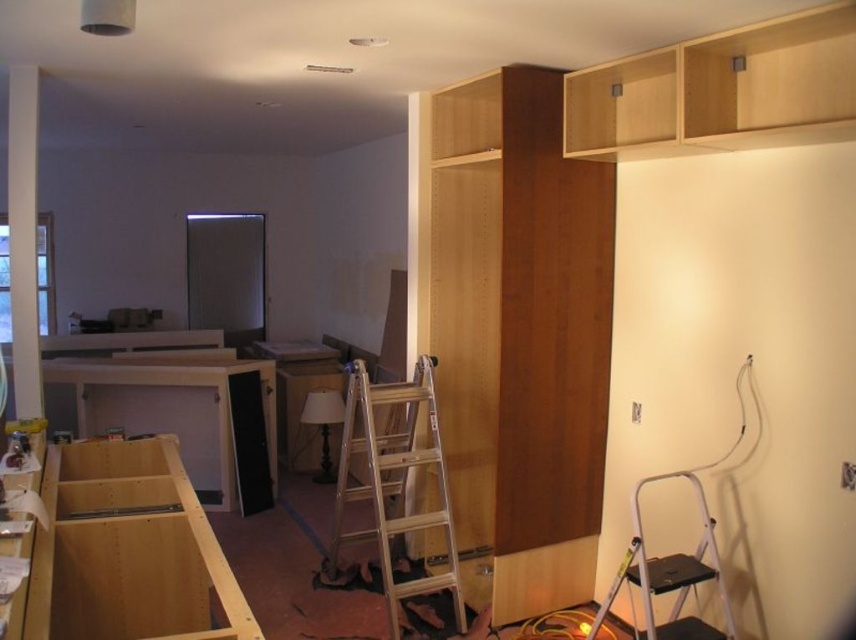
This screenshot has width=856, height=640. Describe the element at coordinates (395, 481) in the screenshot. I see `wooden ladder at center` at that location.

Which of these two, wooden ladder at center or metallic silver step ladder at lower right, stands shorter?

metallic silver step ladder at lower right is shorter.

Is point (432, 461) closer to camera compared to point (711, 561)?

No, (432, 461) is further to viewer.

Find the location of a particular element. wooden ladder at center is located at coordinates (395, 481).